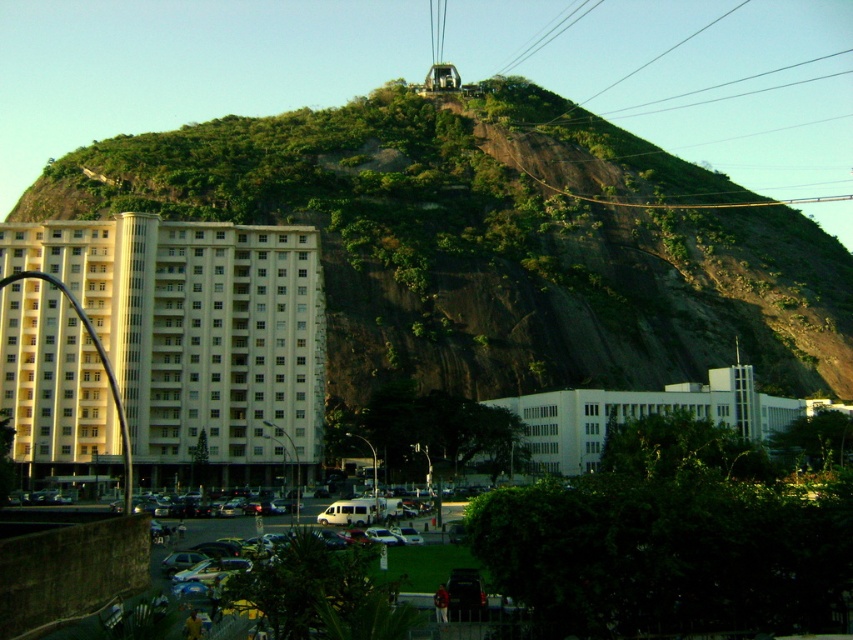
Question: Which point is closer to the camera?

Choices:
 (A) (491, 88)
 (B) (15, 452)
 (C) (722, 378)
 (D) (756, 145)

Answer: (B)

Question: Is green leafy hillside at upper center above white smooth building at center?

Choices:
 (A) yes
 (B) no

Answer: (A)

Question: Considering the relative positions of green leafy hillside at upper center and white smooth building at center in the image provided, where is green leafy hillside at upper center located with respect to white smooth building at center?

Choices:
 (A) right
 (B) left

Answer: (B)

Question: Which of the following is the farthest from the observer?

Choices:
 (A) white smooth building at center
 (B) beige concrete building at left
 (C) green leafy hillside at upper center
 (D) metallic cable car at upper center

Answer: (D)

Question: Where is metallic cable car at upper center located in relation to white smooth building at center in the image?

Choices:
 (A) below
 (B) above

Answer: (B)

Question: Which of the following is the closest to the observer?

Choices:
 (A) beige concrete building at left
 (B) metallic cable car at upper center

Answer: (A)